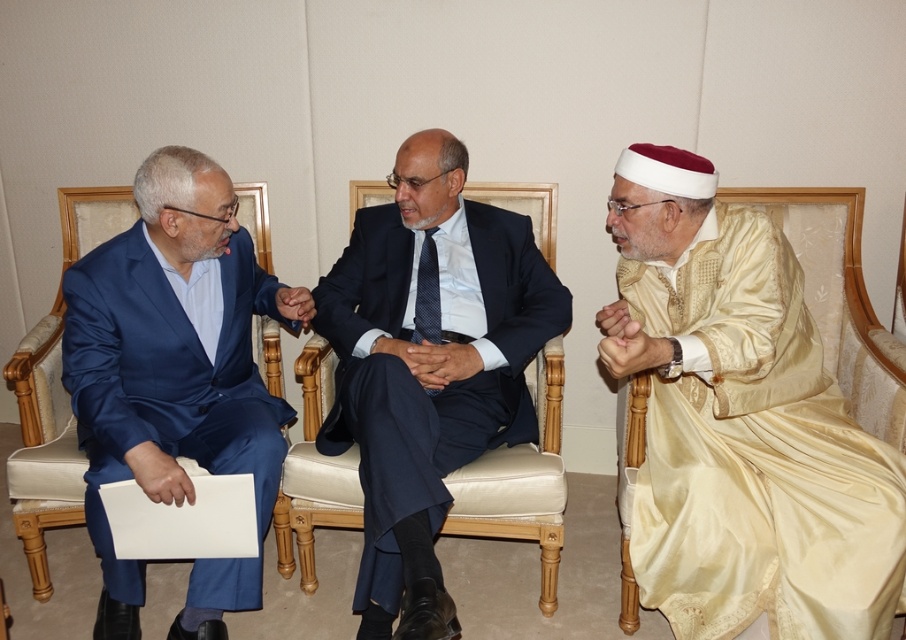
You are organizing a charity event and need to decide which outfit to display first. Based on the sizes of the gold satin robe at right and the satin blue suit at left in the image, which one should you choose to showcase first if you want to start with the larger item?

The gold satin robe at right is bigger than the satin blue suit at left, so you should choose to showcase the gold satin robe at right first since it is the larger item.

From the picture: In the formal setting described, there are two individuals wearing a matte black suit at center and a satin blue suit at left. Which one is positioned more to the right?

The matte black suit at center is positioned more to the right than the satin blue suit at left.

You are standing in the room where the three individuals are seated. You notice two points marked in the scene. Which point is closer to you, point at coordinate (442,161) or point at coordinate (129,588)?

Point at coordinate (442,161) is further to the viewer than point at coordinate (129,588), so the closer point to you is point at coordinate (129,588).